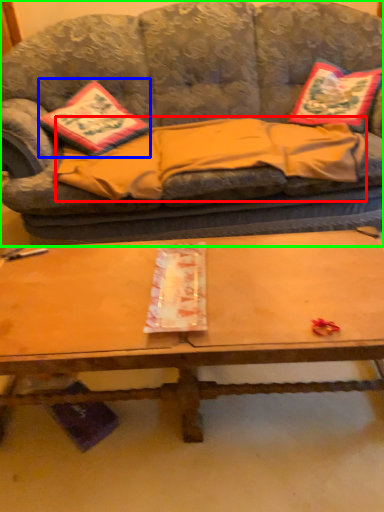
Question: Based on their relative distances, which object is farther from blanket (highlighted by a red box)? Choose from throw pillow (highlighted by a blue box) and studio couch (highlighted by a green box).

Choices:
 (A) throw pillow
 (B) studio couch

Answer: (A)